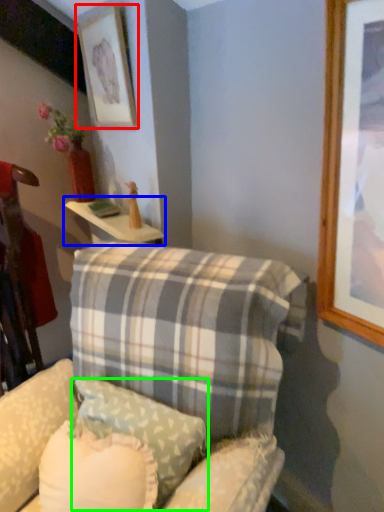
Question: Based on their relative distances, which object is farther from picture frame (highlighted by a red box)? Choose from table (highlighted by a blue box) and pillow (highlighted by a green box).

Choices:
 (A) table
 (B) pillow

Answer: (B)